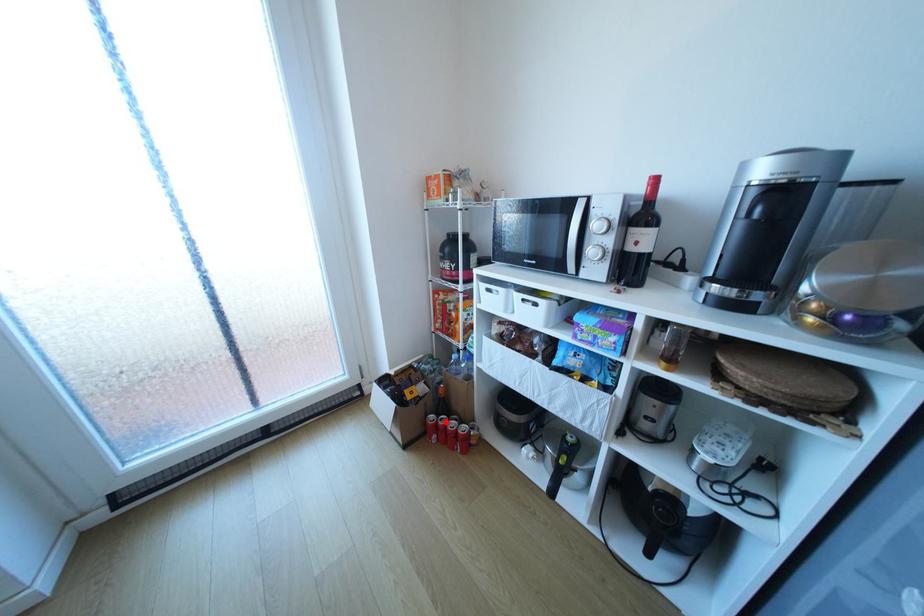
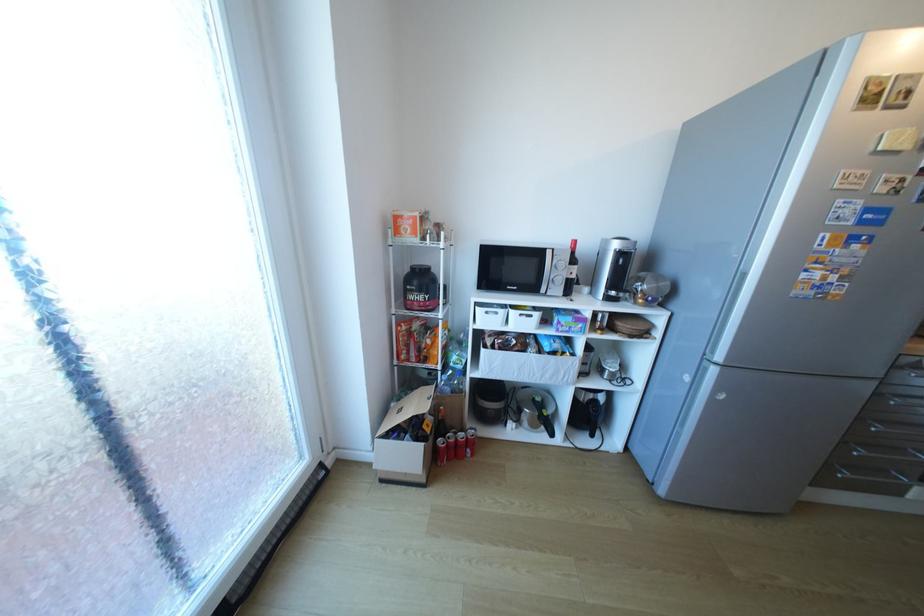
Locate, in the second image, the point that corresponds to the highlighted location in the first image.

(456, 442)